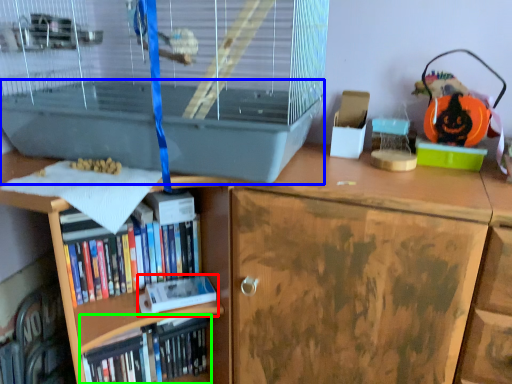
Question: Considering the real-world distances, which object is farthest from paperback book (highlighted by a red box)? wide (highlighted by a blue box) or book (highlighted by a green box)?

Choices:
 (A) wide
 (B) book

Answer: (A)